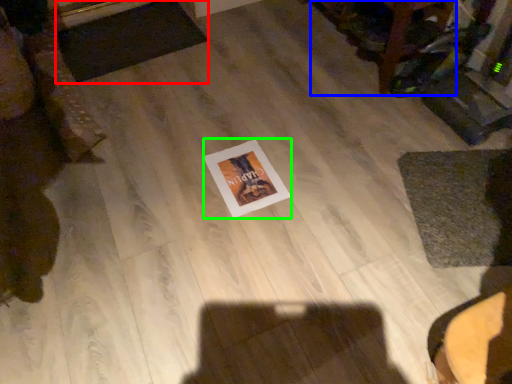
Question: Based on their relative distances, which object is farther from mat (highlighted by a red box)? Choose from furniture (highlighted by a blue box) and postcard (highlighted by a green box).

Choices:
 (A) furniture
 (B) postcard

Answer: (A)